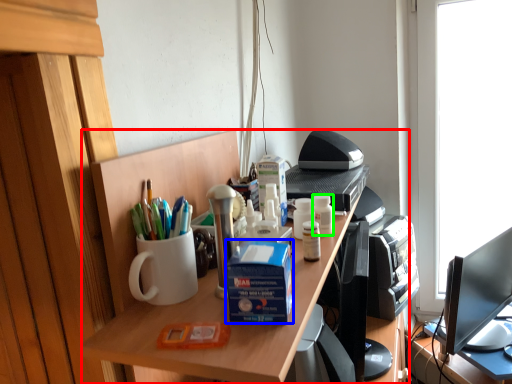
Question: Based on their relative distances, which object is farther from desk (highlighted by a red box)? Choose from box (highlighted by a blue box) and stationery (highlighted by a green box).

Choices:
 (A) box
 (B) stationery

Answer: (B)